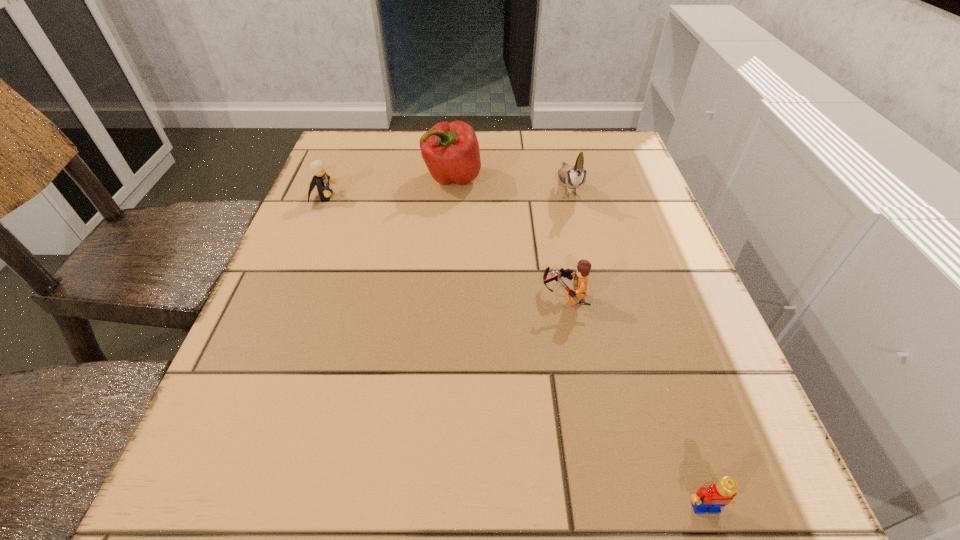
Where is `vacant region between the nearest Lego and the fourth object from right to left`? This screenshot has height=540, width=960. vacant region between the nearest Lego and the fourth object from right to left is located at coordinates (579, 343).

The width and height of the screenshot is (960, 540). I want to click on blank region between the leftmost object and the bird, so coord(446,192).

Image resolution: width=960 pixels, height=540 pixels. Identify the location of free space between the second nearest Lego and the fourth object from right to left. (508, 237).

The width and height of the screenshot is (960, 540). I want to click on free space between the bird and the bell pepper, so click(510, 183).

Locate an element on the screen. vacant space that's between the fourth object from right to left and the second Lego from left to right is located at coordinates (508, 237).

Image resolution: width=960 pixels, height=540 pixels. I want to click on vacant area that lies between the bird and the rightmost Lego, so click(636, 347).

What are the coordinates of `free space that is in between the second object from left to right and the second Lego from left to right` in the screenshot? It's located at (508, 237).

Find the location of a particular element. This screenshot has height=540, width=960. object that can be found as the closest to the bird is located at coordinates (450, 150).

Identify the location of object that is the closest to the bell pepper. Image resolution: width=960 pixels, height=540 pixels. (573, 177).

Identify which Lego is the second closest to the second Lego from left to right. Please provide its 2D coordinates. Your answer should be formatted as a tuple, i.e. [(x, y)], where the tuple contains the x and y coordinates of a point satisfying the conditions above.

[(320, 179)]